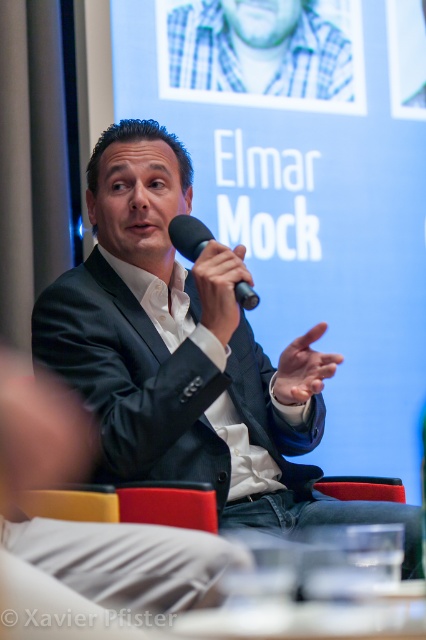
You are an event organizer arranging a photoshoot for a new clothing line. You need to position a model wearing a black suit at center and another wearing a blue plaid shirt at upper center in the frame. Based on the scene description, which clothing item should be placed to the right side of the other?

The black suit at center should be placed to the left of the blue plaid shirt at upper center, so the blue plaid shirt at upper center should be positioned to the right side of the black suit at center.

You are a photographer setting up for a presentation. You need to position a camera so that both the black suit at center and the black matte microphone at upper center are in frame. Based on their positions, which object should appear higher in the photo?

The black matte microphone at upper center appears higher in the photo because it is located above the black suit at center.

You are an assistant who needs to determine the spatial relationship between two points in the image. Given the coordinates of point A at point (238, 72) and point B at point (201, 241), which point is closer to the background?

Point A at point (238, 72) is behind point B at point (201, 241), so point A is closer to the background.